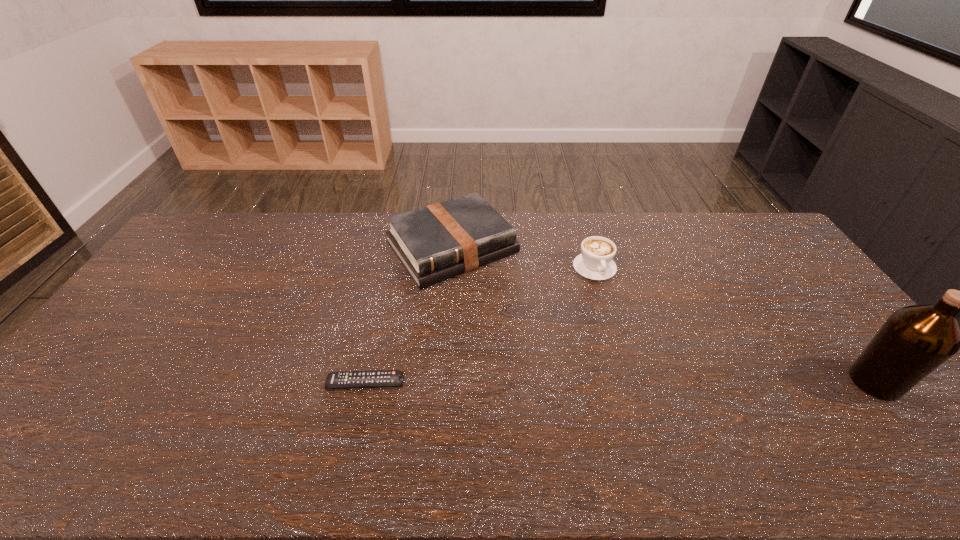
At what (x,y) coordinates should I click in order to perform the action: click on remote control. Please return your answer as a coordinate pair (x, y). Looking at the image, I should click on [x=377, y=378].

Find the location of `olive oil`. olive oil is located at coordinates (915, 340).

The image size is (960, 540). I want to click on the rightmost object, so click(915, 340).

In order to click on the third object from left to right in this screenshot , I will do `click(595, 262)`.

Identify the location of hardback book. (439, 241).

Locate an element on the screen. The width and height of the screenshot is (960, 540). blank area located on the back of the remote control is located at coordinates (381, 312).

Find the location of a particular element. free spot located to the right of the third object from left to right's handle is located at coordinates (641, 365).

Where is `free space located to the right of the third object from left to right's handle`? free space located to the right of the third object from left to right's handle is located at coordinates (639, 362).

At what (x,y) coordinates should I click in order to perform the action: click on vacant area located 0.400m to the right of the third object from left to right's handle. Please return your answer as a coordinate pair (x, y). Looking at the image, I should click on (651, 387).

Locate an element on the screen. vacant space located on the spine side of the hardback book is located at coordinates (550, 360).